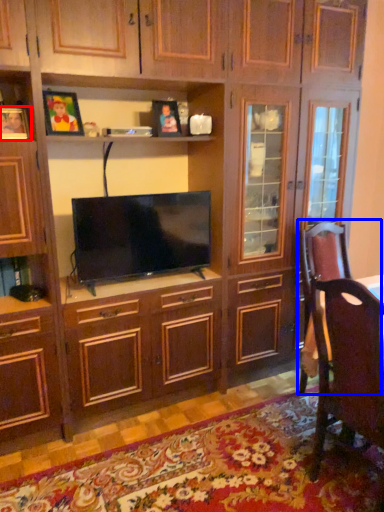
Question: Which object appears closest to the camera in this image, picture frame (highlighted by a red box) or swivel chair (highlighted by a blue box)?

Choices:
 (A) picture frame
 (B) swivel chair

Answer: (A)